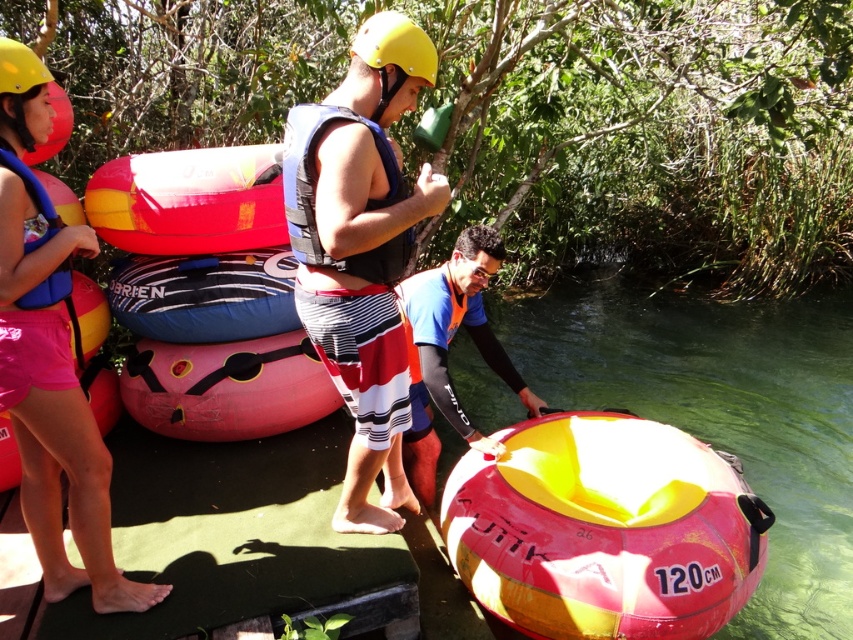
You are a safety inspector checking the gear setup. The matte black life vest at center and the pink fabric shorts at left are placed on the same surface. Which item is taller?

The matte black life vest at center is much taller as pink fabric shorts at left.

You are a photographer standing at the water edge. You see the pink fabric shorts at left and the yellow matte helmet at upper left. Which object is lower in the image?

The pink fabric shorts at left is located below the yellow matte helmet at upper left, so the pink fabric shorts at left is lower in the image.